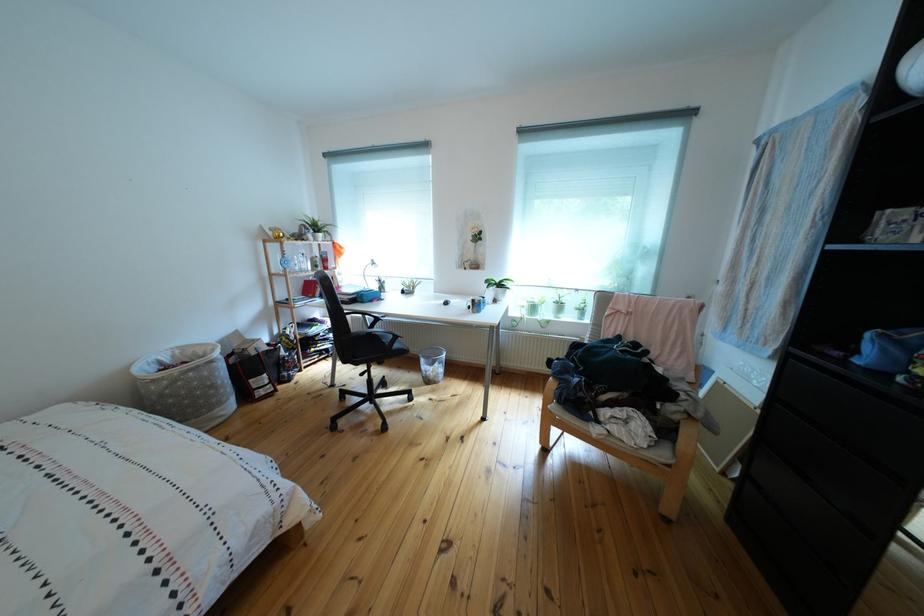
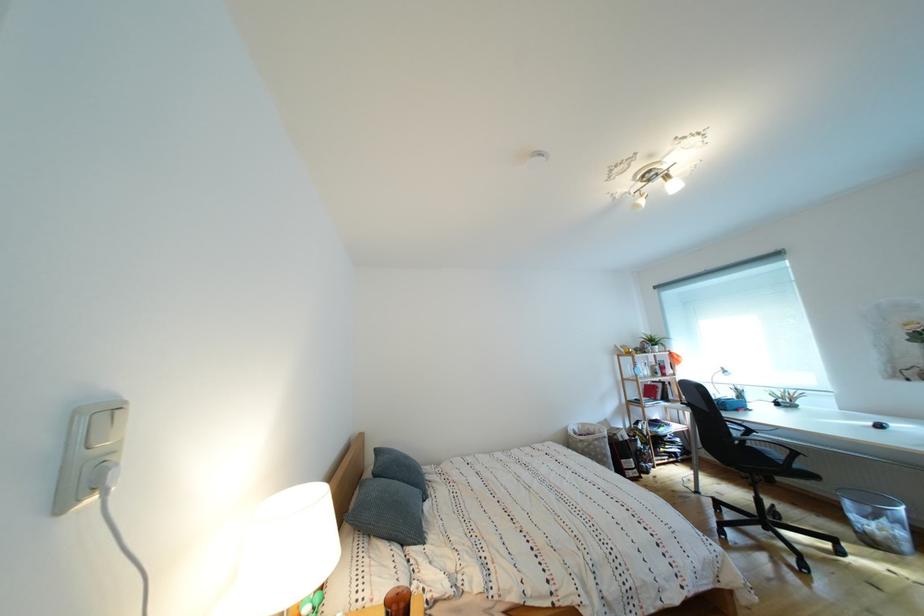
The point at (196, 354) is marked in the first image. Where is the corresponding point in the second image?

(594, 430)